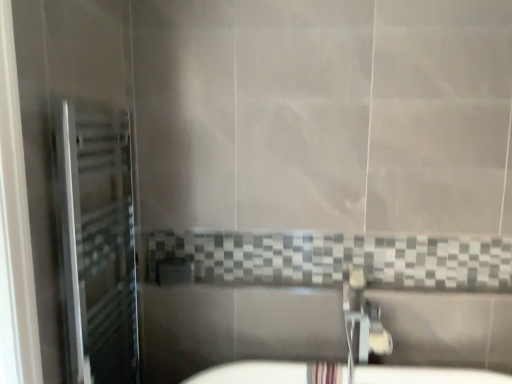
Image resolution: width=512 pixels, height=384 pixels. Describe the element at coordinates (362, 322) in the screenshot. I see `metallic chrome faucet at lower center` at that location.

Identify the location of metallic chrome faucet at lower center. Image resolution: width=512 pixels, height=384 pixels. (362, 322).

What is the approximate height of silver metallic towel rack at left?

The height of silver metallic towel rack at left is 1.36 meters.

Describe the element at coordinates (97, 242) in the screenshot. I see `silver metallic towel rack at left` at that location.

Find the location of a particular element. The height and width of the screenshot is (384, 512). silver metallic towel rack at left is located at coordinates (97, 242).

Consider the image. In order to face silver metallic towel rack at left, should I rotate leftwards or rightwards?

To align with it, rotate left about 18.360°.

Where is `metallic chrome faucet at lower center`? The height and width of the screenshot is (384, 512). metallic chrome faucet at lower center is located at coordinates [x=362, y=322].

Between metallic chrome faucet at lower center and silver metallic towel rack at left, which one appears on the right side from the viewer's perspective?

From the viewer's perspective, metallic chrome faucet at lower center appears more on the right side.

Which is in front, metallic chrome faucet at lower center or silver metallic towel rack at left?

silver metallic towel rack at left is in front.

Which point is more distant from viewer, (358, 326) or (124, 250)?

The point (358, 326) is more distant.

From the image's perspective, is metallic chrome faucet at lower center under silver metallic towel rack at left?

Yes.

From a real-world perspective, is metallic chrome faucet at lower center physically located above or below silver metallic towel rack at left?

Clearly, from a real-world perspective, metallic chrome faucet at lower center is below silver metallic towel rack at left.

Looking at their sizes, would you say metallic chrome faucet at lower center is wider or thinner than silver metallic towel rack at left?

Considering their sizes, metallic chrome faucet at lower center looks broader than silver metallic towel rack at left.

Considering the sizes of metallic chrome faucet at lower center and silver metallic towel rack at left in the image, is metallic chrome faucet at lower center taller or shorter than silver metallic towel rack at left?

Clearly, metallic chrome faucet at lower center is shorter compared to silver metallic towel rack at left.

Considering the sizes of objects metallic chrome faucet at lower center and silver metallic towel rack at left in the image provided, who is bigger, metallic chrome faucet at lower center or silver metallic towel rack at left?

silver metallic towel rack at left.

Can silver metallic towel rack at left be found inside metallic chrome faucet at lower center?

Definitely not — silver metallic towel rack at left is not inside metallic chrome faucet at lower center.

Is metallic chrome faucet at lower center with silver metallic towel rack at left?

No, metallic chrome faucet at lower center is not making contact with silver metallic towel rack at left.

Is metallic chrome faucet at lower center oriented towards silver metallic towel rack at left?

No, metallic chrome faucet at lower center is not facing towards silver metallic towel rack at left.

Where is `screen door in front of the metallic chrome faucet at lower center`? Image resolution: width=512 pixels, height=384 pixels. screen door in front of the metallic chrome faucet at lower center is located at coordinates (97, 242).

In the scene shown: Which is more to the left, silver metallic towel rack at left or metallic chrome faucet at lower center?

silver metallic towel rack at left.

Which object is closer to the camera taking this photo, silver metallic towel rack at left or metallic chrome faucet at lower center?

silver metallic towel rack at left is closer to the camera.

Between point (66, 131) and point (358, 283), which one is positioned in front?

The point (66, 131) is closer to the camera.

From the image's perspective, who appears lower, silver metallic towel rack at left or metallic chrome faucet at lower center?

metallic chrome faucet at lower center is shown below in the image.

From a real-world perspective, does silver metallic towel rack at left stand above metallic chrome faucet at lower center?

Correct, in the physical world, silver metallic towel rack at left is higher than metallic chrome faucet at lower center.

Looking at this image, between silver metallic towel rack at left and metallic chrome faucet at lower center, which one has larger width?

metallic chrome faucet at lower center.

From their relative heights in the image, would you say silver metallic towel rack at left is taller or shorter than metallic chrome faucet at lower center?

In the image, silver metallic towel rack at left appears to be taller than metallic chrome faucet at lower center.

Considering the relative sizes of silver metallic towel rack at left and metallic chrome faucet at lower center in the image provided, is silver metallic towel rack at left smaller than metallic chrome faucet at lower center?

No.

From the picture: Is metallic chrome faucet at lower center inside silver metallic towel rack at left?

No.

Is silver metallic towel rack at left touching metallic chrome faucet at lower center?

silver metallic towel rack at left and metallic chrome faucet at lower center are not in contact.

Could you tell me if silver metallic towel rack at left is facing metallic chrome faucet at lower center?

Yes, silver metallic towel rack at left is oriented towards metallic chrome faucet at lower center.

Can you tell me how much silver metallic towel rack at left and metallic chrome faucet at lower center differ in facing direction?

There is a 88.9-degree angle between the facing directions of silver metallic towel rack at left and metallic chrome faucet at lower center.

How distant is silver metallic towel rack at left from metallic chrome faucet at lower center?

A distance of 3.74 feet exists between silver metallic towel rack at left and metallic chrome faucet at lower center.

Identify the location of screen door above the metallic chrome faucet at lower center (from the image's perspective). The width and height of the screenshot is (512, 384). (97, 242).

Identify the location of plumbing fixture below the silver metallic towel rack at left (from the image's perspective). Image resolution: width=512 pixels, height=384 pixels. (362, 322).

Where is `plumbing fixture that appears on the right of silver metallic towel rack at left`? The height and width of the screenshot is (384, 512). plumbing fixture that appears on the right of silver metallic towel rack at left is located at coordinates (362, 322).